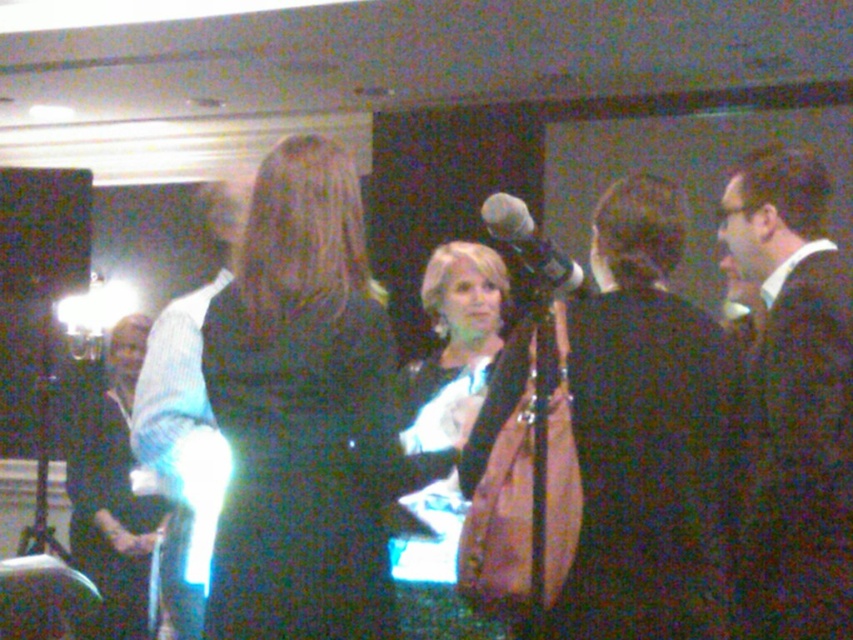
You are a photographer at an event and need to adjust the lighting so that both the black fabric dress at center and the black suit at right are equally illuminated. Given that the spotlight is on the left, which object might require additional lighting to match the brightness?

The black fabric dress at center might require additional lighting because it is wider than the black suit at right and could be casting a larger shadow area, making it appear darker under the existing spotlight.

Based on the scene description, where is the shiny black dress at center located in terms of coordinates?

The shiny black dress at center is located at coordinates point (456, 342).